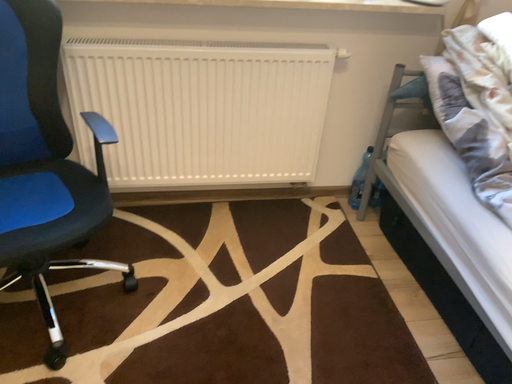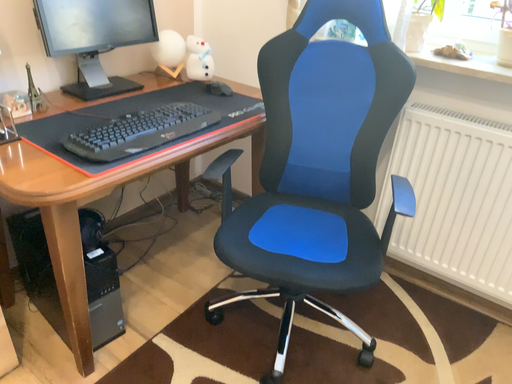
Question: How did the camera likely rotate when shooting the video?

Choices:
 (A) rotated upward
 (B) rotated downward

Answer: (A)